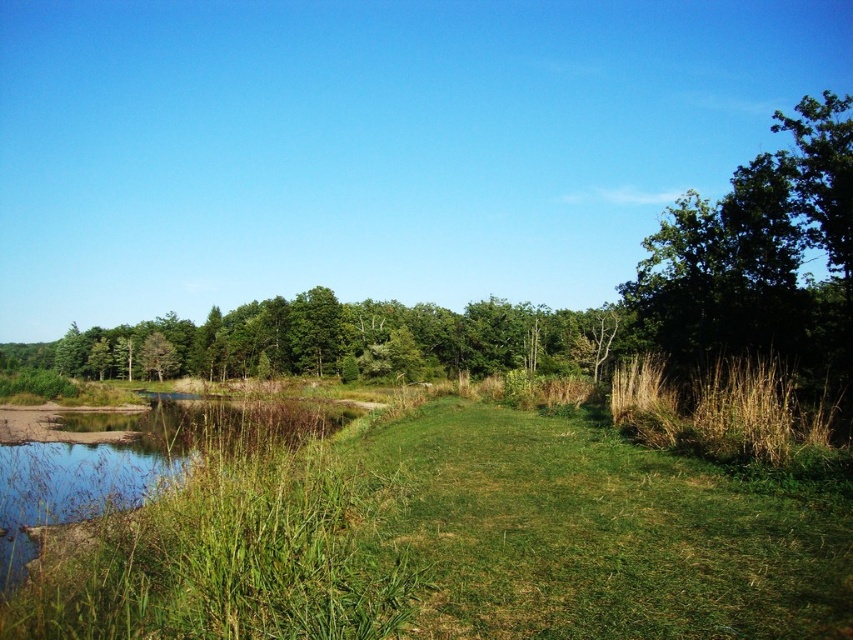
Question: Which point is closer to the camera taking this photo?

Choices:
 (A) (825, 228)
 (B) (746, 374)

Answer: (B)

Question: Can you confirm if green leafy tree at upper right is smaller than brown grassy reed at right?

Choices:
 (A) no
 (B) yes

Answer: (A)

Question: Which point is farther from the camera taking this photo?

Choices:
 (A) (786, 456)
 (B) (799, 316)

Answer: (B)

Question: Is green leafy tree at upper right below brown grassy reed at right?

Choices:
 (A) no
 (B) yes

Answer: (A)

Question: Observing the image, what is the correct spatial positioning of green leafy tree at upper right in reference to brown grassy reed at right?

Choices:
 (A) left
 (B) right

Answer: (B)